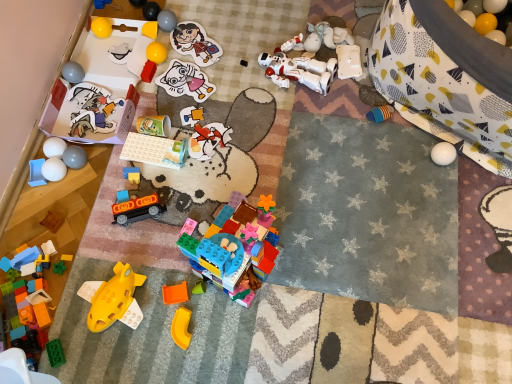
Image resolution: width=512 pixels, height=384 pixels. In order to click on free space between matte blue plastic toy at center, marked as the thirteenth toy in a right-to-left arrangement, and yellow matte plastic arch at center, which appears as the 21th toy when viewed from the left in this screenshot , I will do `click(157, 257)`.